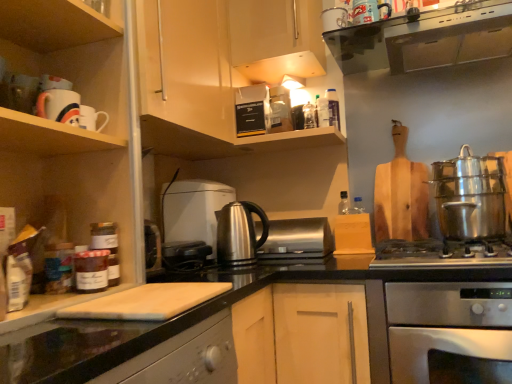
Question: Which direction should I rotate to look at stainless steel kettle at center, the 2th kitchen appliance from the back?

Choices:
 (A) left
 (B) right

Answer: (A)

Question: Is clear plastic bottle at upper center further to camera compared to wooden cutting board at upper left, acting as the first cabinetry starting from the front?

Choices:
 (A) yes
 (B) no

Answer: (A)

Question: Is clear plastic bottle at upper center smaller than wooden cutting board at upper left, acting as the first cabinetry starting from the front?

Choices:
 (A) no
 (B) yes

Answer: (B)

Question: Does clear plastic bottle at upper center lie in front of wooden cutting board at upper left, the third cabinetry when ordered from back to front?

Choices:
 (A) yes
 (B) no

Answer: (B)

Question: Considering the relative sizes of clear plastic bottle at upper center and wooden cutting board at upper left, acting as the first cabinetry starting from the front, in the image provided, is clear plastic bottle at upper center taller than wooden cutting board at upper left, acting as the first cabinetry starting from the front,?

Choices:
 (A) no
 (B) yes

Answer: (A)

Question: Is wooden cutting board at upper left, the third cabinetry when ordered from back to front, located within clear plastic bottle at upper center?

Choices:
 (A) no
 (B) yes

Answer: (A)

Question: Is clear plastic bottle at upper center bigger than wooden cutting board at upper left, the third cabinetry when ordered from back to front?

Choices:
 (A) no
 (B) yes

Answer: (A)

Question: Considering the relative sizes of stainless steel kettle at center, the 1th kitchen appliance positioned from the front, and stainless steel gas stove at lower right in the image provided, is stainless steel kettle at center, the 1th kitchen appliance positioned from the front, bigger than stainless steel gas stove at lower right?

Choices:
 (A) yes
 (B) no

Answer: (B)

Question: Could stainless steel gas stove at lower right be considered to be inside stainless steel kettle at center, the 2th kitchen appliance from the back?

Choices:
 (A) no
 (B) yes

Answer: (A)

Question: Is stainless steel kettle at center, the 1th kitchen appliance positioned from the front, turned away from stainless steel gas stove at lower right?

Choices:
 (A) no
 (B) yes

Answer: (A)

Question: From a real-world perspective, is stainless steel kettle at center, the 1th kitchen appliance positioned from the front, over stainless steel gas stove at lower right?

Choices:
 (A) no
 (B) yes

Answer: (B)

Question: Considering the relative sizes of stainless steel kettle at center, the 2th kitchen appliance from the back, and stainless steel gas stove at lower right in the image provided, is stainless steel kettle at center, the 2th kitchen appliance from the back, thinner than stainless steel gas stove at lower right?

Choices:
 (A) yes
 (B) no

Answer: (A)

Question: Is the position of stainless steel kettle at center, the 2th kitchen appliance from the back, less distant than that of stainless steel gas stove at lower right?

Choices:
 (A) yes
 (B) no

Answer: (B)

Question: Is stainless steel oven at lower right oriented away from wooden cutting board at upper left, the third cabinetry when ordered from back to front?

Choices:
 (A) yes
 (B) no

Answer: (B)